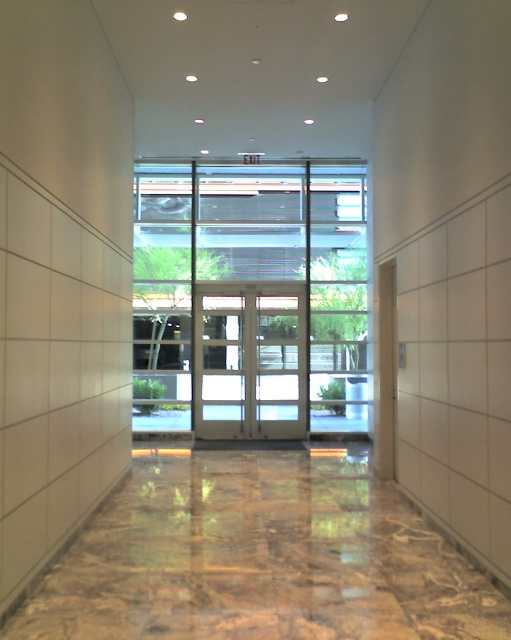
Is clear glass doors at center positioned before white glass doors at center?

No, clear glass doors at center is behind white glass doors at center.

Who is more distant from viewer, (x=192, y=342) or (x=301, y=412)?

Answer: Positioned behind is point (x=192, y=342).

Identify the location of clear glass doors at center. This screenshot has height=640, width=511. (251, 296).

Which is in front, point (228, 360) or point (303, 337)?

Positioned in front is point (303, 337).

Is the position of white glass door at center less distant than that of matte glass door at center?

No, white glass door at center is further to the viewer.

Between point (242, 362) and point (304, 330), which one is positioned in front?

Point (242, 362)

This screenshot has width=511, height=640. In order to click on white glass door at center in this screenshot , I will do `click(221, 364)`.

Between clear glass doors at center and matte glass door at center, which one appears on the left side from the viewer's perspective?

clear glass doors at center

Between clear glass doors at center and matte glass door at center, which one has less height?

Standing shorter between the two is clear glass doors at center.

Which is behind, point (190, 241) or point (284, 291)?

Positioned behind is point (190, 241).

At what (x,y) coordinates should I click in order to perform the action: click on clear glass doors at center. Please return your answer as a coordinate pair (x, y). This screenshot has height=640, width=511. Looking at the image, I should click on (251, 296).